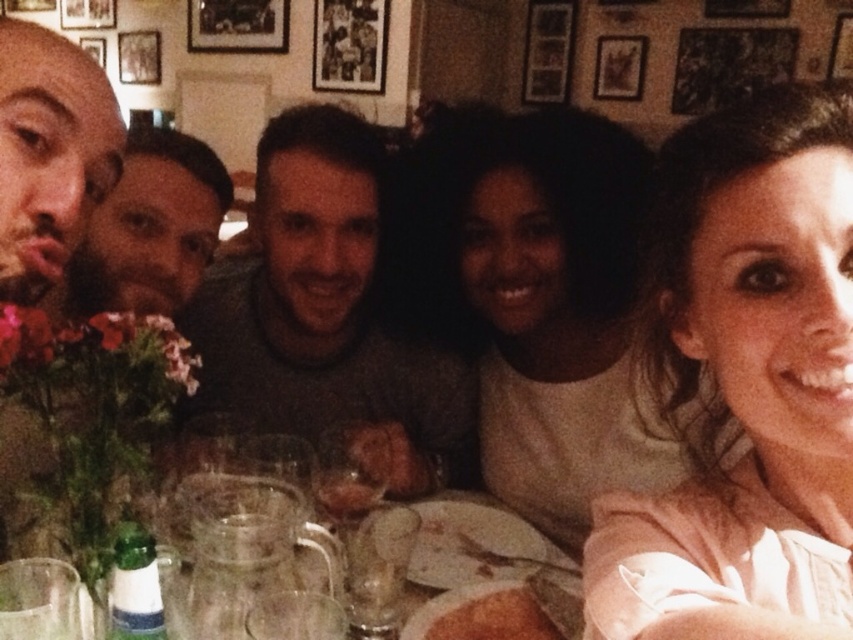
Who is more distant from viewer, (47, 150) or (444, 586)?

Positioned behind is point (444, 586).

Between bald head at left and clear glass plates at center, which one appears on the left side from the viewer's perspective?

bald head at left is more to the left.

Which is behind, point (102, 164) or point (463, 492)?

The point (463, 492) is behind.

Find the location of a particular element. This screenshot has height=640, width=853. bald head at left is located at coordinates (49, 154).

Image resolution: width=853 pixels, height=640 pixels. Identify the location of pink fabric shirt at upper right. (746, 385).

In the scene shown: Can you confirm if pink fabric shirt at upper right is positioned to the right of brown crumbly bread at lower center?

Indeed, pink fabric shirt at upper right is positioned on the right side of brown crumbly bread at lower center.

Is point (822, 525) less distant than point (515, 618)?

Yes.

The image size is (853, 640). I want to click on pink fabric shirt at upper right, so click(746, 385).

This screenshot has width=853, height=640. Describe the element at coordinates (538, 300) in the screenshot. I see `light beige sweater at center` at that location.

How far apart are light beige sweater at center and dark brown hair at left?

light beige sweater at center is 16.15 inches away from dark brown hair at left.

Does point (415, 300) lie behind point (219, 211)?

That is True.

I want to click on light beige sweater at center, so click(538, 300).